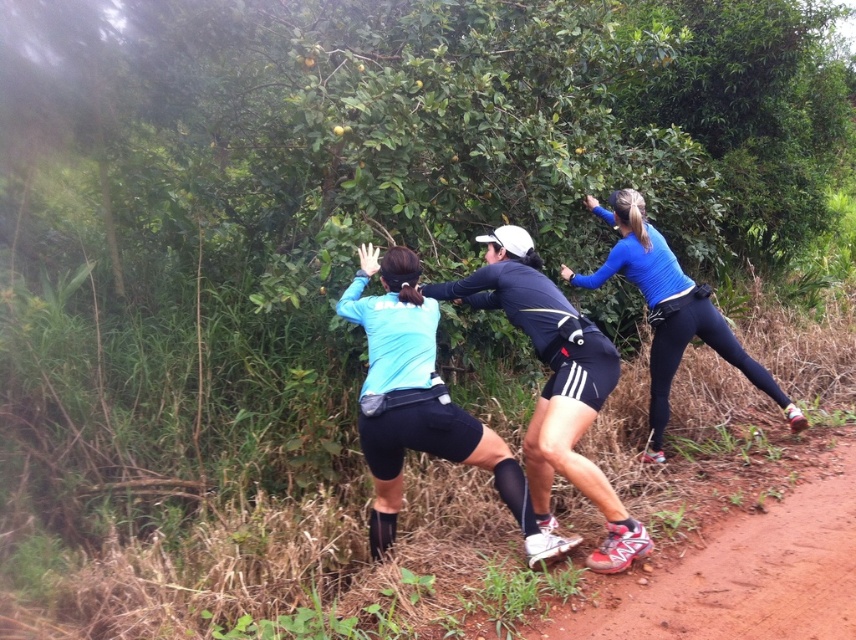
Question: Is blue matte running top at center to the left of blue matte shirt at center from the viewer's perspective?

Choices:
 (A) yes
 (B) no

Answer: (A)

Question: Among these points, which one is nearest to the camera?

Choices:
 (A) (623, 220)
 (B) (373, 340)

Answer: (B)

Question: Is blue matte running top at center to the right of blue matte shirt at center from the viewer's perspective?

Choices:
 (A) yes
 (B) no

Answer: (B)

Question: Is blue matte running top at center smaller than blue matte shirt at center?

Choices:
 (A) yes
 (B) no

Answer: (A)

Question: Which of the following is the closest to the observer?

Choices:
 (A) blue matte shirt at center
 (B) blue matte running top at center

Answer: (B)